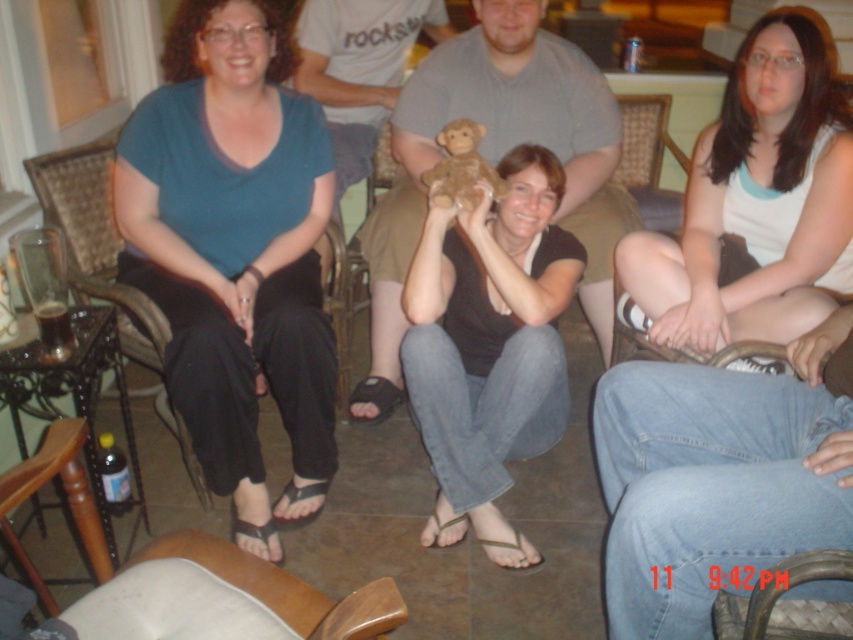
Based on the photo, you are a photographer trying to capture a group photo of the people in the living room. You notice the gray cotton shirt at center and the brown leather armchair at lower left. Which object takes up more space in the photo?

The gray cotton shirt at center takes up more space in the photo because its width is larger than that of the brown leather armchair at lower left.